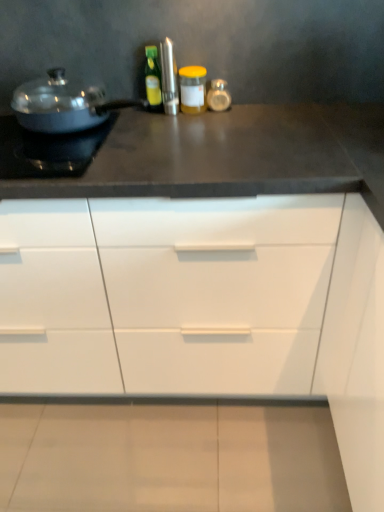
You are a GUI agent. You are given a task and a screenshot of the screen. Output one action in this format:
    pyautogui.click(x=<x>, y=<y>)
    Task: Click on the blank space to the left of yellow matte jar at center, which ranks as the first bottle in right-to-left order
    
    Given the screenshot: What is the action you would take?
    pyautogui.click(x=139, y=117)